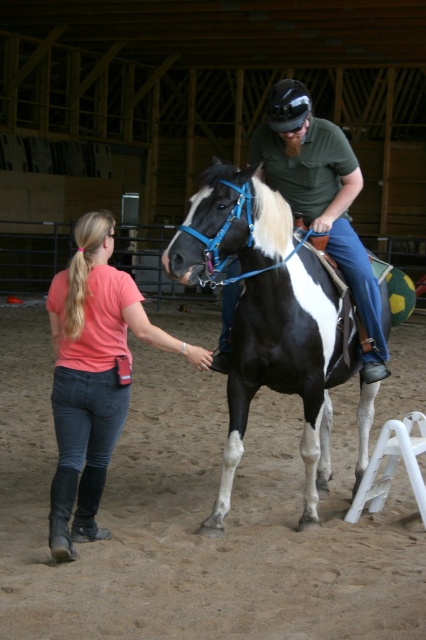
Can you confirm if brown sand at lower center is positioned to the left of matte green shirt at center?

Yes, brown sand at lower center is to the left of matte green shirt at center.

Who is taller, brown sand at lower center or matte green shirt at center?

With more height is matte green shirt at center.

This screenshot has height=640, width=426. I want to click on brown sand at lower center, so click(x=195, y=516).

The image size is (426, 640). Find the location of `brown sand at lower center`. brown sand at lower center is located at coordinates (195, 516).

How far apart are black and white speckled horse at center and denim jeans at lower left?

They are 28.96 inches apart.

Can you confirm if black and white speckled horse at center is bigger than denim jeans at lower left?

Yes, black and white speckled horse at center is bigger than denim jeans at lower left.

Which is behind, point (319, 426) or point (106, 419)?

Positioned behind is point (319, 426).

Locate an element on the screen. The image size is (426, 640). black and white speckled horse at center is located at coordinates (267, 321).

Which is above, brown sand at lower center or black and white speckled horse at center?

Positioned higher is black and white speckled horse at center.

Between brown sand at lower center and black and white speckled horse at center, which one appears on the right side from the viewer's perspective?

black and white speckled horse at center

What do you see at coordinates (195, 516) in the screenshot? I see `brown sand at lower center` at bounding box center [195, 516].

The width and height of the screenshot is (426, 640). Find the location of `brown sand at lower center`. brown sand at lower center is located at coordinates (195, 516).